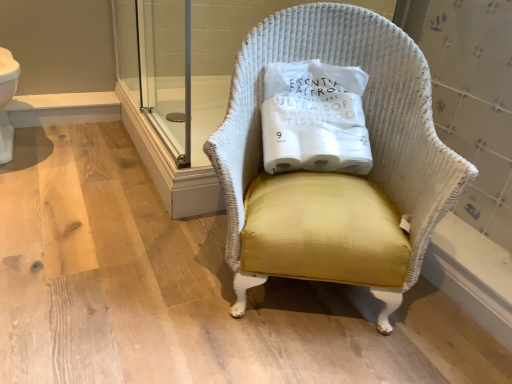
Question: Considering the positions of white wicker chair at center and yellow fabric pillow at center in the image, is white wicker chair at center taller or shorter than yellow fabric pillow at center?

Choices:
 (A) tall
 (B) short

Answer: (A)

Question: Is white wicker chair at center in front of or behind yellow fabric pillow at center in the image?

Choices:
 (A) behind
 (B) front

Answer: (B)

Question: In terms of width, does white wicker chair at center look wider or thinner when compared to yellow fabric pillow at center?

Choices:
 (A) thin
 (B) wide

Answer: (B)

Question: Considering their positions, is yellow fabric pillow at center located in front of or behind white wicker chair at center?

Choices:
 (A) behind
 (B) front

Answer: (A)

Question: Considering the positions of yellow fabric pillow at center and white wicker chair at center in the image, is yellow fabric pillow at center wider or thinner than white wicker chair at center?

Choices:
 (A) wide
 (B) thin

Answer: (B)

Question: From their relative heights in the image, would you say yellow fabric pillow at center is taller or shorter than white wicker chair at center?

Choices:
 (A) short
 (B) tall

Answer: (A)

Question: Is yellow fabric pillow at center bigger or smaller than white wicker chair at center?

Choices:
 (A) big
 (B) small

Answer: (B)